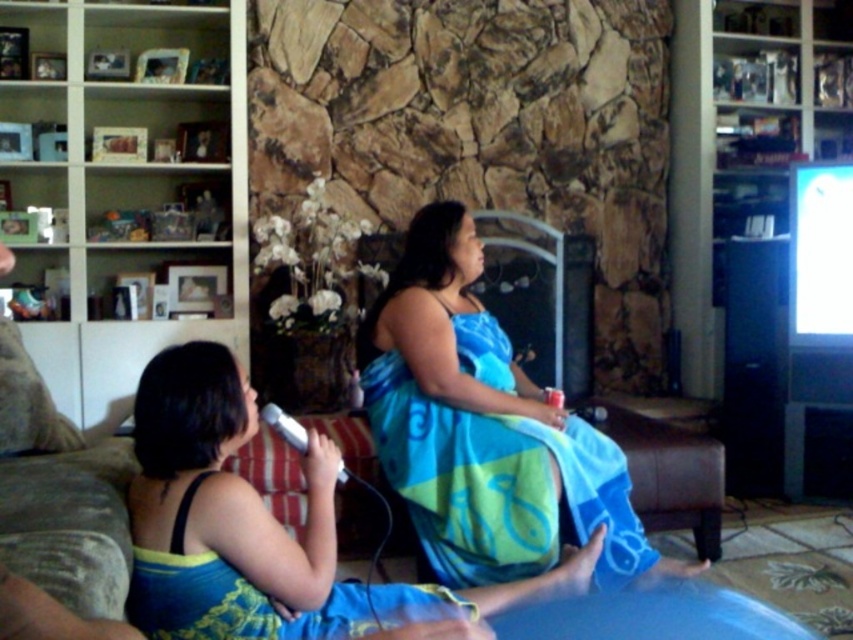
Can you confirm if blue fabric dress at center is positioned to the right of velvet brown couch at lower left?

Correct, you'll find blue fabric dress at center to the right of velvet brown couch at lower left.

Who is shorter, blue fabric dress at center or velvet brown couch at lower left?

With less height is velvet brown couch at lower left.

Measure the distance between point (468, 320) and camera.

They are 8.41 feet apart.

Where is `blue fabric dress at center`? blue fabric dress at center is located at coordinates (485, 429).

Is velvet brown couch at lower left positioned at the back of white plastic microphone at center?

No, it is in front of white plastic microphone at center.

The width and height of the screenshot is (853, 640). What do you see at coordinates (57, 493) in the screenshot?
I see `velvet brown couch at lower left` at bounding box center [57, 493].

Who is more distant from viewer, (74, 452) or (283, 424)?

Positioned behind is point (74, 452).

In order to click on velvet brown couch at lower left in this screenshot , I will do `click(57, 493)`.

Is point (434, 384) positioned behind point (289, 428)?

Yes, it is.

Between point (544, 456) and point (303, 452), which one is positioned behind?

Point (544, 456)

The width and height of the screenshot is (853, 640). What do you see at coordinates (485, 429) in the screenshot? I see `blue fabric dress at center` at bounding box center [485, 429].

Identify the location of blue fabric dress at center. This screenshot has height=640, width=853. (485, 429).